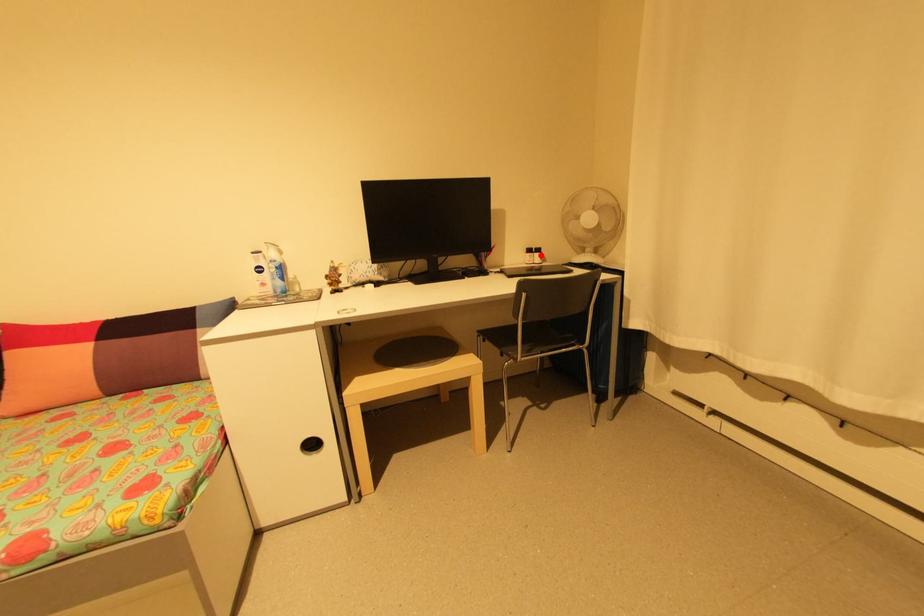
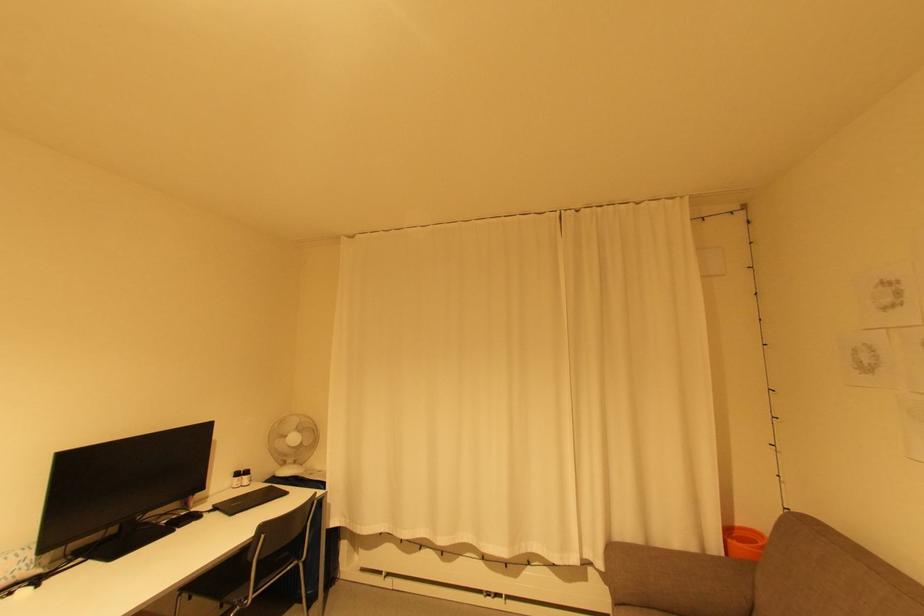
Where in the second image is the point corresponding to the highlighted location from the first image?

(250, 477)